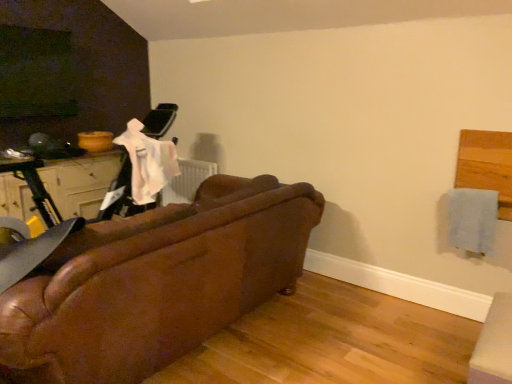
Question: Looking at the image, does leather couch at center seem bigger or smaller compared to matte white drawer at left?

Choices:
 (A) small
 (B) big

Answer: (B)

Question: From the image's perspective, relative to matte white drawer at left, is leather couch at center above or below?

Choices:
 (A) above
 (B) below

Answer: (B)

Question: Estimate the real-world distances between objects in this image. Which object is farther from the matte white drawer at left?

Choices:
 (A) leather couch at center
 (B) light blue fabric at upper right

Answer: (B)

Question: Which object is positioned closest to the matte white drawer at left?

Choices:
 (A) leather couch at center
 (B) light blue fabric at upper right

Answer: (A)